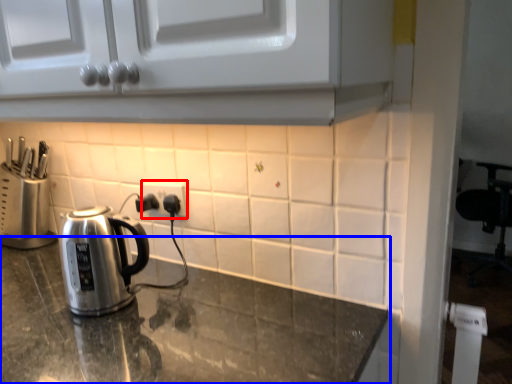
Question: Which point is closer to the camera, electric outlet (highlighted by a red box) or countertop (highlighted by a blue box)?

Choices:
 (A) electric outlet
 (B) countertop

Answer: (B)